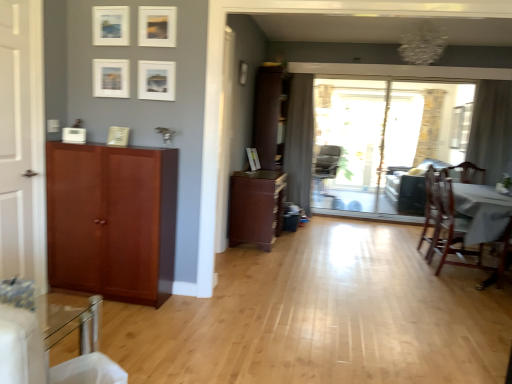
Question: Is matte white picture frame at upper center, marked as the second picture frame in a left-to-right arrangement, situated inside sheer fabric curtain at right, arranged as the 2th curtain when viewed from the left, or outside?

Choices:
 (A) inside
 (B) outside

Answer: (B)

Question: Visually, is matte white picture frame at upper center, which is counted as the 3th picture frame, starting from the front, positioned to the left or to the right of sheer fabric curtain at right, the 1th curtain viewed from the front?

Choices:
 (A) right
 (B) left

Answer: (B)

Question: Which object is positioned farthest from the wooden chair at right, the third chair viewed from the back?

Choices:
 (A) brown wood cabinet at center, marked as the third cabinetry in a left-to-right arrangement
 (B) sheer fabric curtain at right, arranged as the 2th curtain when viewed from the left
 (C) gray fabric chair at center, the 3th chair viewed from the front
 (D) matte white picture frame at upper center, the 7th picture frame when ordered from back to front
 (E) gray fabric curtain at center, arranged as the first curtain when viewed from the back

Answer: (D)

Question: Considering the real-world distances, which object is closest to the brown wood cabinet at center, which is the second cabinetry from left to right?

Choices:
 (A) wooden chair at right, positioned as the 2th chair in back-to-front order
 (B) matte white picture frame at center, acting as the 1th picture frame starting from the right
 (C) brown wood cabinet at center, which ranks as the 1th cabinetry in right-to-left order
 (D) wooden chair at right, positioned as the first chair in front-to-back order
 (E) sheer fabric curtain at right, marked as the 2th curtain in a back-to-front arrangement

Answer: (B)